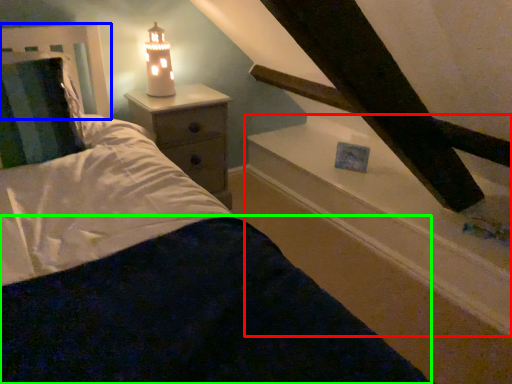
Question: Based on their relative distances, which object is farther from window sill (highlighted by a red box)? Choose from headboard (highlighted by a blue box) and bedding (highlighted by a green box).

Choices:
 (A) headboard
 (B) bedding

Answer: (A)